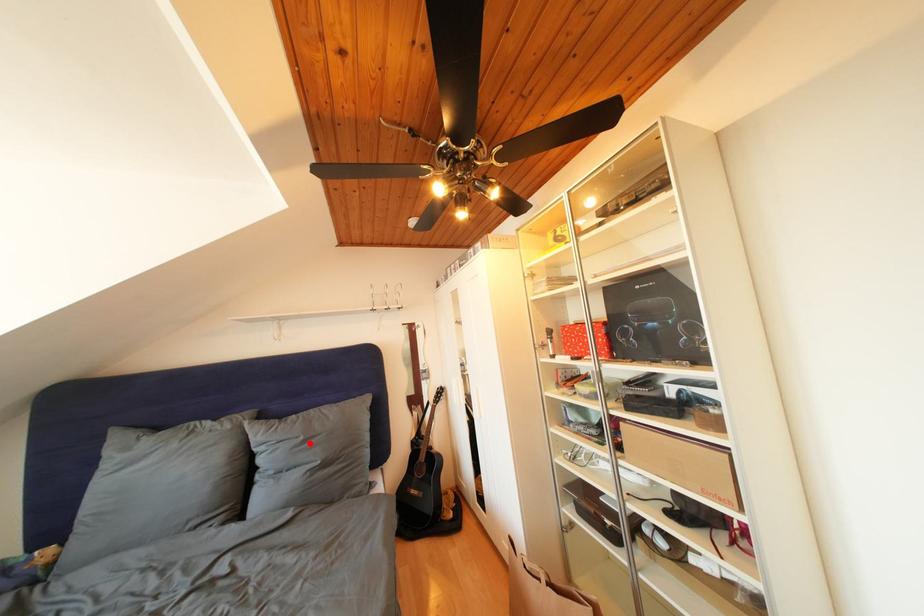
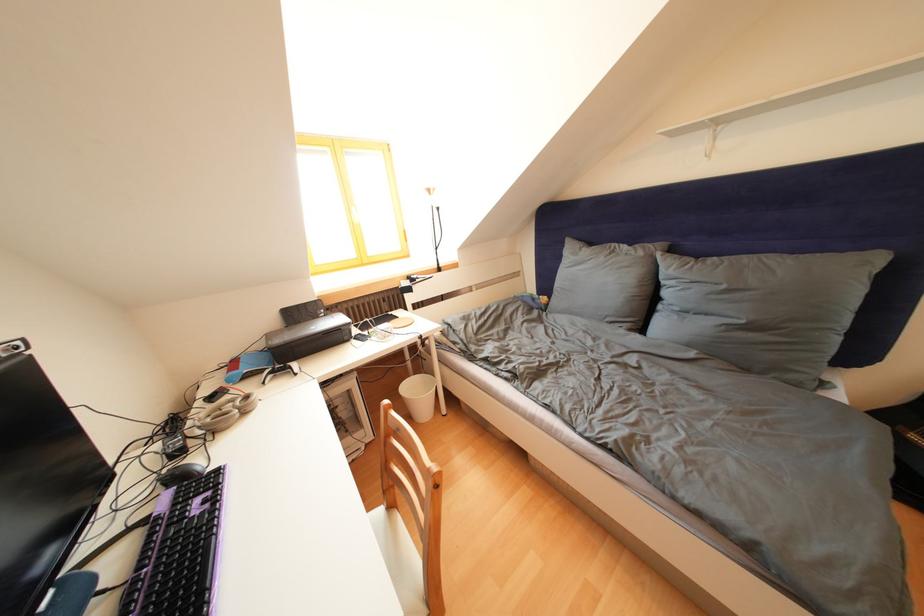
Question: I am providing you with two images of the same scene from different viewpoints. In image1, a red point is highlighted. Considering the same 3D point in image2, which of the following is correct?

Choices:
 (A) It is closer
 (B) It is farther

Answer: (A)